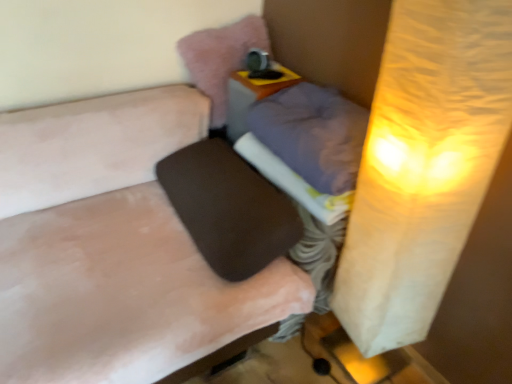
Find the location of `brown matte speaker at center`. brown matte speaker at center is located at coordinates (114, 247).

The width and height of the screenshot is (512, 384). What do you see at coordinates (221, 58) in the screenshot?
I see `pink plush pillow at upper center, the 2th pillow positioned from the bottom` at bounding box center [221, 58].

Describe the element at coordinates (252, 95) in the screenshot. I see `matte plastic table at center` at that location.

What is the approximate height of black fabric footrest at center?

black fabric footrest at center is 19.73 centimeters tall.

Where is `white paper lampshade at upper right`? The image size is (512, 384). white paper lampshade at upper right is located at coordinates (423, 165).

The image size is (512, 384). Identify the location of brown matte speaker at center. (114, 247).

Is there a large distance between brown matte speaker at center and matte plastic table at center?

No, brown matte speaker at center is not far from matte plastic table at center.

Consider the image. Is brown matte speaker at center aimed at matte plastic table at center?

No, brown matte speaker at center is not turned towards matte plastic table at center.

From a real-world perspective, is brown matte speaker at center over matte plastic table at center?

No, from a real-world perspective, brown matte speaker at center is not over matte plastic table at center

From a real-world perspective, is purple fabric pillow at center, the first pillow ordered from the bottom, physically located above or below white paper lampshade at upper right?

In terms of real-world spatial position, purple fabric pillow at center, the first pillow ordered from the bottom, is above white paper lampshade at upper right.

Is purple fabric pillow at center, which is the 2th pillow from top to bottom, in front of white paper lampshade at upper right?

No, it is behind white paper lampshade at upper right.

Can you confirm if purple fabric pillow at center, which is the 2th pillow from top to bottom, is taller than white paper lampshade at upper right?

No.

Consider the image. Is black fabric footrest at center directly adjacent to white paper lampshade at upper right?

They are not placed beside each other.

From the image's perspective, relative to white paper lampshade at upper right, is black fabric footrest at center above or below?

Based on their image positions, black fabric footrest at center is located above white paper lampshade at upper right.

Does black fabric footrest at center have a lesser height compared to white paper lampshade at upper right?

Correct, black fabric footrest at center is not as tall as white paper lampshade at upper right.

Who is taller, white fabric at center or black fabric footrest at center?

With more height is black fabric footrest at center.

In terms of size, does white fabric at center appear bigger or smaller than black fabric footrest at center?

Clearly, white fabric at center is smaller in size than black fabric footrest at center.

Does white fabric at center have a lesser width compared to black fabric footrest at center?

Yes, white fabric at center is thinner than black fabric footrest at center.

From the image's perspective, would you say pink plush pillow at upper center, which is counted as the first pillow, starting from the top, is positioned over metallic silver table lamp at upper center?

Yes, from the image's perspective, pink plush pillow at upper center, which is counted as the first pillow, starting from the top, is on top of metallic silver table lamp at upper center.

In terms of size, does pink plush pillow at upper center, which is counted as the first pillow, starting from the top, appear bigger or smaller than metallic silver table lamp at upper center?

Clearly, pink plush pillow at upper center, which is counted as the first pillow, starting from the top, is larger in size than metallic silver table lamp at upper center.

Which object is thinner, pink plush pillow at upper center, the 2th pillow positioned from the bottom, or metallic silver table lamp at upper center?

metallic silver table lamp at upper center.

Considering the sizes of white fabric at center and brown matte speaker at center in the image, is white fabric at center taller or shorter than brown matte speaker at center?

In the image, white fabric at center appears to be shorter than brown matte speaker at center.

Who is more distant, white fabric at center or brown matte speaker at center?

white fabric at center is more distant.

Is white fabric at center not close to brown matte speaker at center?

No, white fabric at center is not far from brown matte speaker at center.

Looking at this image, from the image's perspective, between white fabric at center and brown matte speaker at center, who is located below?

brown matte speaker at center appears lower in the image.

Is pink plush pillow at upper center, the 2th pillow positioned from the bottom, spatially inside white fabric at center, or outside of it?

pink plush pillow at upper center, the 2th pillow positioned from the bottom, is spatially situated outside white fabric at center.

Considering the relative sizes of pink plush pillow at upper center, which is counted as the first pillow, starting from the top, and white fabric at center in the image provided, is pink plush pillow at upper center, which is counted as the first pillow, starting from the top, smaller than white fabric at center?

Indeed, pink plush pillow at upper center, which is counted as the first pillow, starting from the top, has a smaller size compared to white fabric at center.

From a real-world perspective, which pillow is the 2nd one above the white fabric at center? Please provide its 2D coordinates.

[(221, 58)]

Does point (237, 25) come in front of point (310, 192)?

No.

Where is `table above the brown matte speaker at center (from a real-world perspective)`? table above the brown matte speaker at center (from a real-world perspective) is located at coordinates (252, 95).

I want to click on the 1st pillow behind the white paper lampshade at upper right, counting from the anchor's position, so click(x=313, y=134).

Based on their spatial positions, is brown matte speaker at center or purple fabric pillow at center, the first pillow ordered from the bottom, closer to white paper lampshade at upper right?

The object closer to white paper lampshade at upper right is purple fabric pillow at center, the first pillow ordered from the bottom.

Based on their spatial positions, is white paper lampshade at upper right or white fabric at center closer to metallic silver table lamp at upper center?

white fabric at center.

Estimate the real-world distances between objects in this image. Which object is closer to black fabric footrest at center, white fabric at center or purple fabric pillow at center, which is the 2th pillow from top to bottom?

white fabric at center is closer to black fabric footrest at center.

When comparing their distances from pink plush pillow at upper center, which is counted as the first pillow, starting from the top, does matte plastic table at center or black fabric footrest at center seem closer?

matte plastic table at center is positioned closer to the anchor pink plush pillow at upper center, which is counted as the first pillow, starting from the top.

Looking at this image, which object lies nearer to the anchor point brown matte speaker at center, white paper lampshade at upper right or metallic silver table lamp at upper center?

white paper lampshade at upper right lies closer to brown matte speaker at center than the other object.

Which object lies further to the anchor point matte plastic table at center, white paper lampshade at upper right or purple fabric pillow at center, the first pillow ordered from the bottom?

Among the two, white paper lampshade at upper right is located further to matte plastic table at center.

From the image, which object appears to be farther from matte plastic table at center, brown matte speaker at center or purple fabric pillow at center, which is the 2th pillow from top to bottom?

brown matte speaker at center is further to matte plastic table at center.

Based on their spatial positions, is metallic silver table lamp at upper center or matte plastic table at center closer to white fabric at center?

matte plastic table at center.

Identify the location of table lamp between pink plush pillow at upper center, the 2th pillow positioned from the bottom, and white fabric at center vertically. (260, 65).

The height and width of the screenshot is (384, 512). What are the coordinates of `the footrest positioned between brown matte speaker at center and pink plush pillow at upper center, which is counted as the first pillow, starting from the top, from near to far` in the screenshot? It's located at (229, 208).

Where is `lamp between brown matte speaker at center and metallic silver table lamp at upper center in the front-back direction`? lamp between brown matte speaker at center and metallic silver table lamp at upper center in the front-back direction is located at coordinates (423, 165).

Identify the location of pillow between white paper lampshade at upper right and pink plush pillow at upper center, the 2th pillow positioned from the bottom, along the z-axis. The height and width of the screenshot is (384, 512). (313, 134).